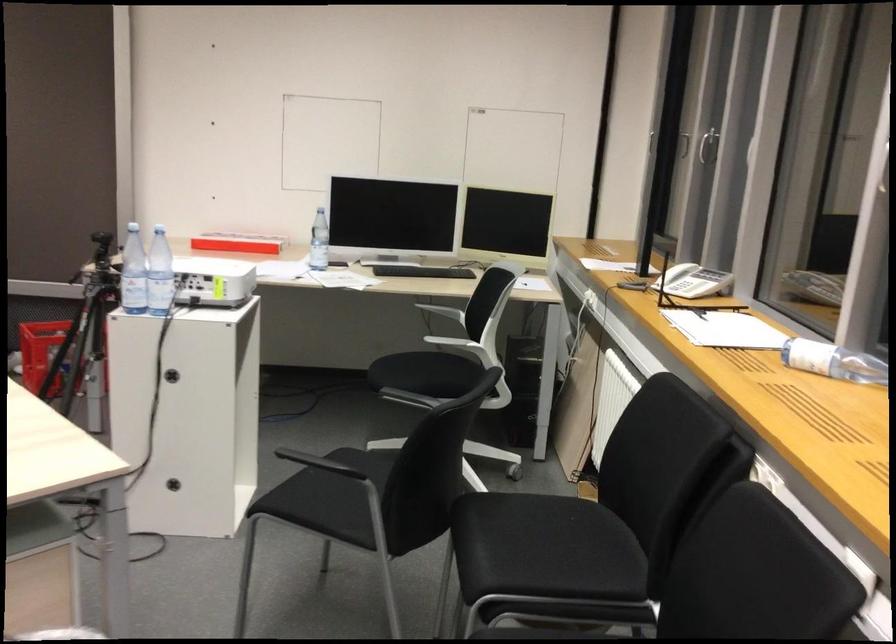
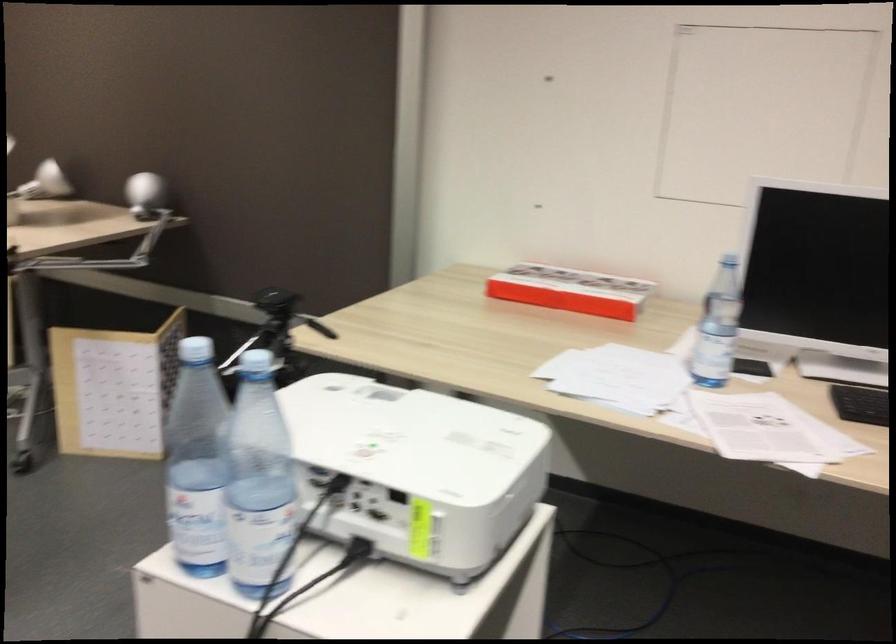
Locate, in the second image, the point that corresponds to (x=240, y=243) in the first image.

(570, 290)